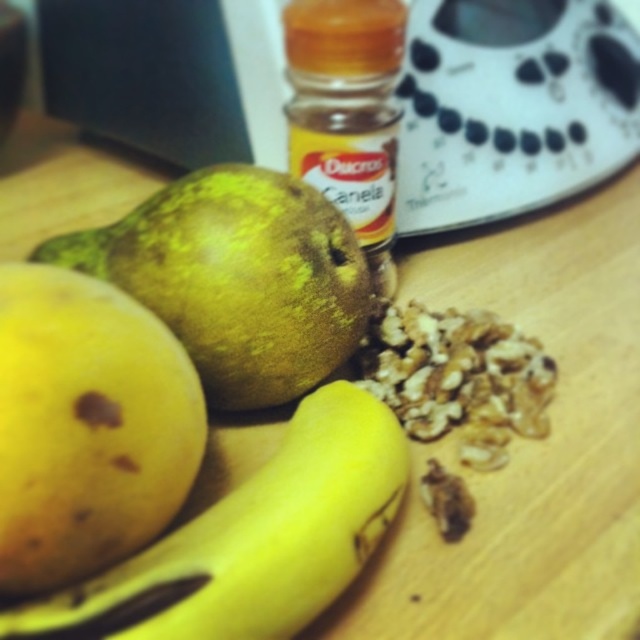
Question: Which point appears closest to the camera in this image?

Choices:
 (A) (262, 388)
 (B) (314, 612)
 (C) (99, 372)

Answer: (C)

Question: Can you confirm if yellow matte apple at lower left is wider than green matte pear at center?

Choices:
 (A) no
 (B) yes

Answer: (A)

Question: Can you confirm if green matte pear at center is positioned above yellow matte banana at center?

Choices:
 (A) yes
 (B) no

Answer: (A)

Question: Can you confirm if yellow matte apple at lower left is thinner than green matte pear at center?

Choices:
 (A) no
 (B) yes

Answer: (B)

Question: Which of the following is the farthest from the observer?

Choices:
 (A) (292, 355)
 (B) (32, 444)

Answer: (A)

Question: Which point appears farthest from the camera in this image?

Choices:
 (A) (268, 497)
 (B) (97, 532)

Answer: (A)